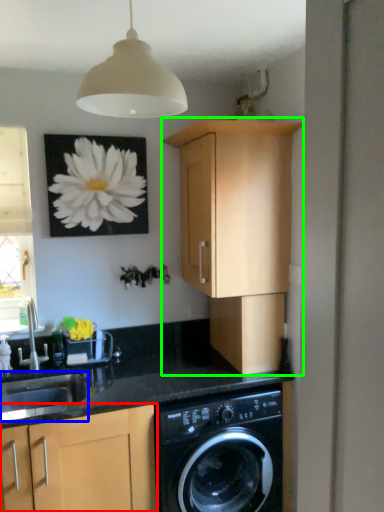
Question: Estimate the real-world distances between objects in this image. Which object is farther from cabinetry (highlighted by a red box), sink (highlighted by a blue box) or cabinetry (highlighted by a green box)?

Choices:
 (A) sink
 (B) cabinetry

Answer: (B)